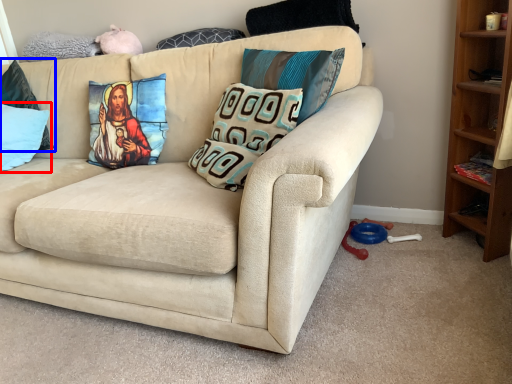
Question: Among these objects, which one is farthest to the camera, pillow (highlighted by a red box) or pillow (highlighted by a blue box)?

Choices:
 (A) pillow
 (B) pillow

Answer: (B)